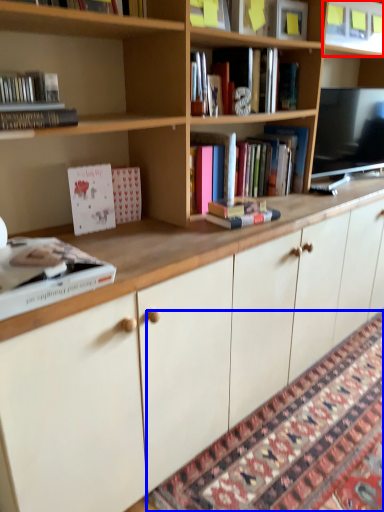
Question: Which object appears farthest to the camera in this image, shelf (highlighted by a red box) or mat (highlighted by a blue box)?

Choices:
 (A) shelf
 (B) mat

Answer: (A)